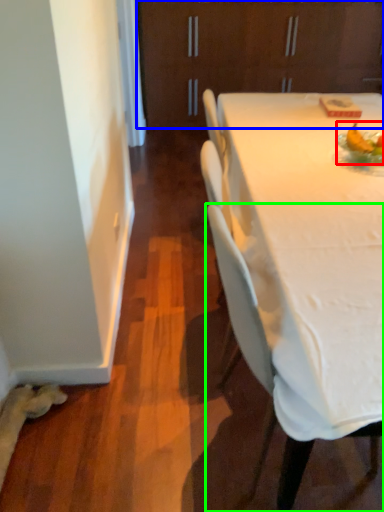
Question: Which is nearer to the food (highlighted by a red box)? cabinetry (highlighted by a blue box) or chair (highlighted by a green box).

Choices:
 (A) cabinetry
 (B) chair

Answer: (B)